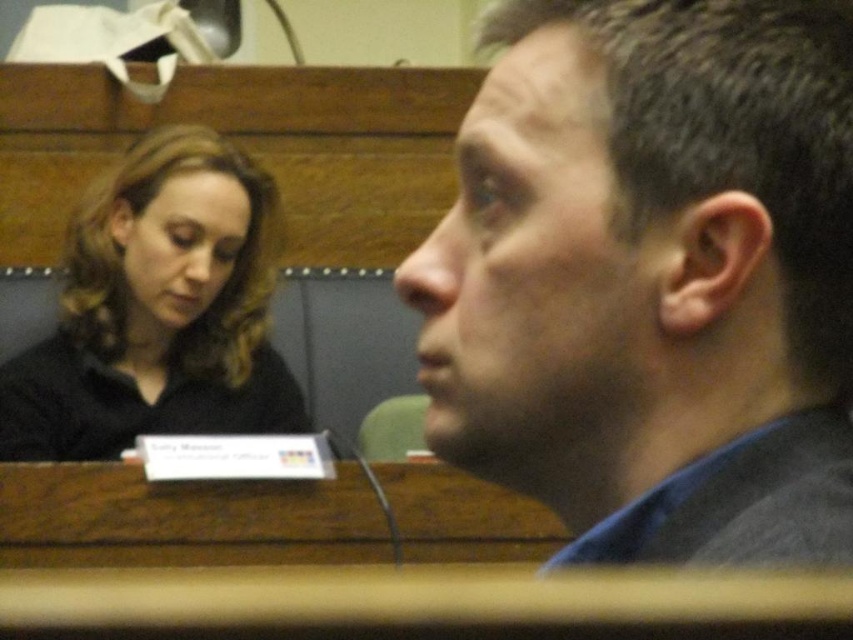
You are standing in the conference room and need to determine which of the two points, point [577,353] or point [22,365], is closer to you. Based on the image, which point is nearer?

Point [577,353] is closer to the viewer than point [22,365].

You are an event planner organizing a seating arrangement. You need to place two name tags on a table. The name tags must be placed in the same positions as the dark gray hair at upper right and the black matte hair at upper left. Which name tag should be placed higher on the table?

The name tag for the dark gray hair at upper right should be placed higher on the table because it is positioned over the black matte hair at upper left.

You are an event planner arranging seating for a meeting. You need to place a name tag for the person with dark gray hair at upper right and the person with black matte hair at upper left. Based on their positions in the image, which side of the table should each name tag be placed?

The dark gray hair at upper right should be placed on the right side of the table, and the black matte hair at upper left should be placed on the left side of the table since the dark gray hair at upper right is positioned on the right side of black matte hair at upper left.